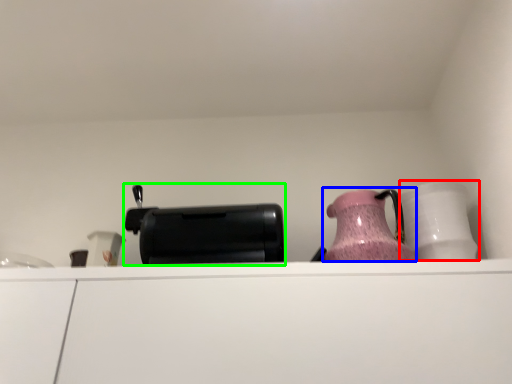
Question: Which object is the farthest from tableware (highlighted by a red box)? Choose among these: jug (highlighted by a blue box) or appliance (highlighted by a green box).

Choices:
 (A) jug
 (B) appliance

Answer: (B)